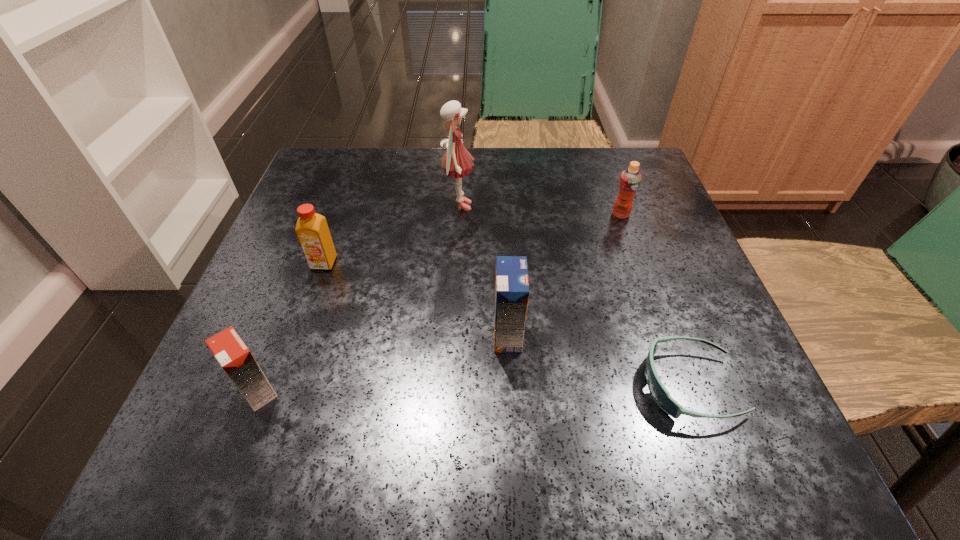
In the image, there is a desktop. At what (x,y) coordinates should I click in order to perform the action: click on free region at the near left corner. Please return your answer as a coordinate pair (x, y). This screenshot has width=960, height=540. Looking at the image, I should click on (202, 472).

Find the location of a particular element. This screenshot has width=960, height=540. vacant region at the near right corner of the desktop is located at coordinates pos(746,418).

Find the location of a particular element. free space between the doll and the goggles is located at coordinates (574, 295).

Find the location of a particular element. free space between the third farthest object and the second orange juice from right to left is located at coordinates (416, 299).

The width and height of the screenshot is (960, 540). What are the coordinates of `vacant area that lies between the shortest object and the nearest orange juice` in the screenshot? It's located at (473, 388).

You are a GUI agent. You are given a task and a screenshot of the screen. Output one action in this format:
    pyautogui.click(x=<x>, y=<y>)
    Task: Click on the free space between the doll and the fourth object from left to right
    
    Given the screenshot: What is the action you would take?
    pyautogui.click(x=483, y=270)

You are a GUI agent. You are given a task and a screenshot of the screen. Output one action in this format:
    pyautogui.click(x=<x>, y=<y>)
    Task: Click on the free spot between the shortest object and the farthest orange juice
    This screenshot has width=960, height=540.
    Given the screenshot: What is the action you would take?
    [x=656, y=300]

I want to click on free space that is in between the goggles and the tallest object, so click(x=574, y=295).

Where is `empty space between the third farthest object and the nearest orange juice`? The width and height of the screenshot is (960, 540). empty space between the third farthest object and the nearest orange juice is located at coordinates (291, 327).

Where is `empty space that is in between the third farthest object and the second nearest orange juice`? empty space that is in between the third farthest object and the second nearest orange juice is located at coordinates (416, 299).